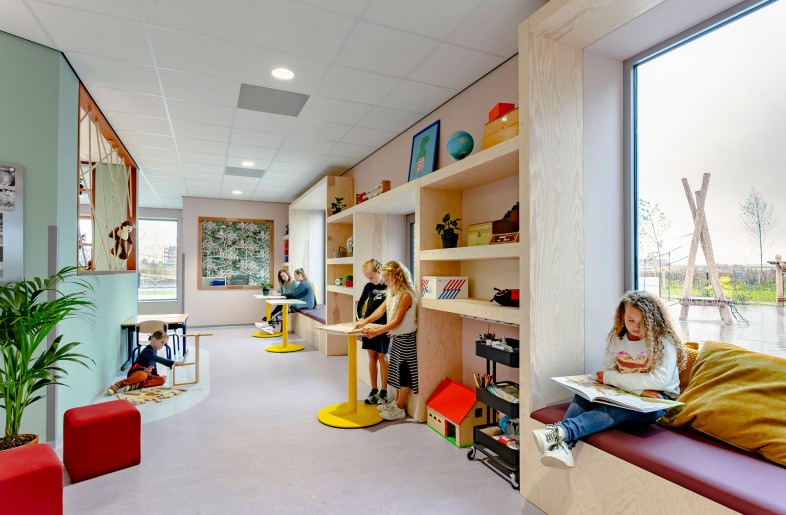
Where is `light bulb`? The height and width of the screenshot is (515, 786). light bulb is located at coordinates (281, 74).